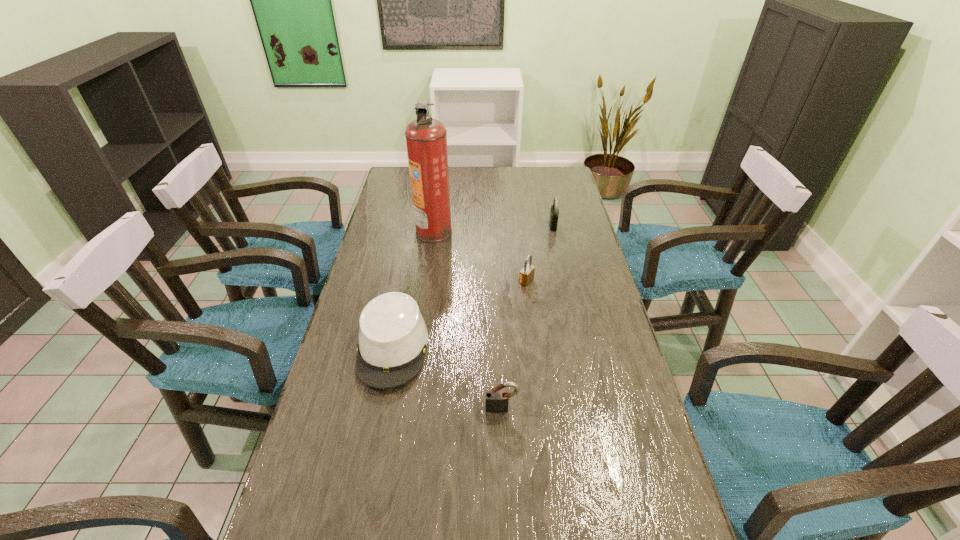
Locate an element on the screen. padlock that stands as the second closest to the nearest object is located at coordinates (554, 212).

Identify the location of the second closest padlock relative to the farthest padlock. (497, 401).

The height and width of the screenshot is (540, 960). Identify the location of vacant space that satisfies the following two spatial constraints: 1. at the nozzle of the fire extinguisher; 2. on the left side of the second farthest padlock. (427, 281).

Where is `vacant point that satisfies the following two spatial constraints: 1. on the back side of the second object from right to left; 2. at the nozzle of the tallest object`? This screenshot has height=540, width=960. vacant point that satisfies the following two spatial constraints: 1. on the back side of the second object from right to left; 2. at the nozzle of the tallest object is located at coordinates (520, 232).

Identify the location of vacant space that satisfies the following two spatial constraints: 1. at the nozzle of the fire extinguisher; 2. on the right side of the fourth object from left to right. The width and height of the screenshot is (960, 540). (427, 281).